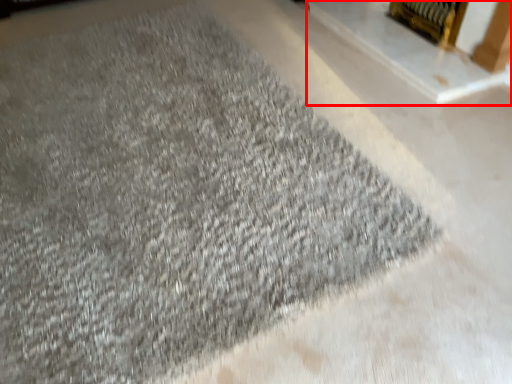
Question: From the image, what is the correct spatial relationship of fireplace (annotated by the red box) in relation to fireplace?

Choices:
 (A) right
 (B) left

Answer: (B)